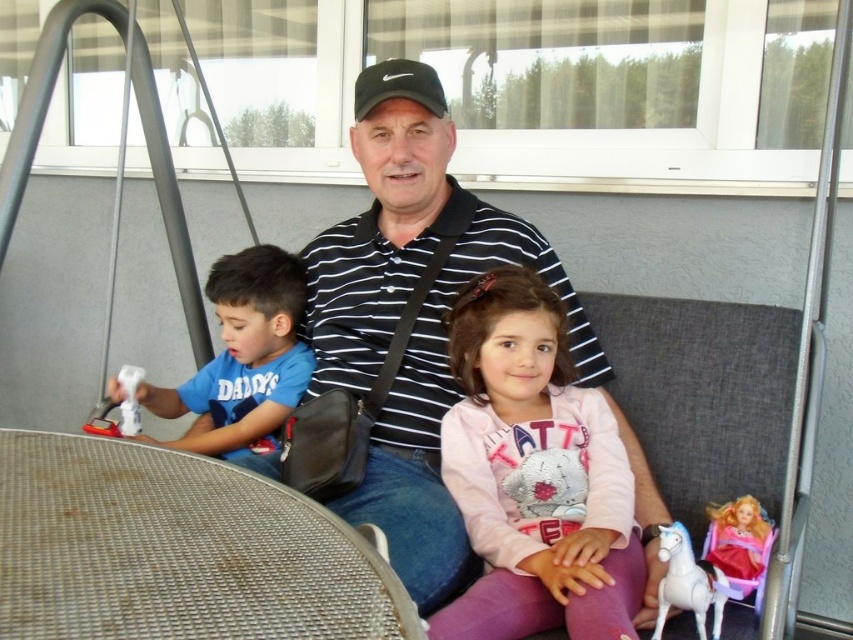
Can you confirm if pink fleece jacket at center is wider than white plastic toy at left?

Yes, pink fleece jacket at center is wider than white plastic toy at left.

Between pink fleece jacket at center and white plastic toy at left, which one is positioned lower?

pink fleece jacket at center

Where is `pink fleece jacket at center`? Image resolution: width=853 pixels, height=640 pixels. pink fleece jacket at center is located at coordinates (534, 474).

Can you confirm if shiny plastic doll at lower right is thinner than white plastic toy at left?

No.

Does point (724, 544) come in front of point (134, 412)?

Yes.

Image resolution: width=853 pixels, height=640 pixels. I want to click on shiny plastic doll at lower right, so click(738, 538).

Is point (291, 276) positioned behind point (120, 129)?

No, it is in front of (120, 129).

Is point (292, 394) positioned before point (213, 118)?

Yes, it is.

I want to click on blue cotton shirt at left, so click(244, 362).

What are the coordinates of `blue cotton shirt at left` in the screenshot? It's located at (244, 362).